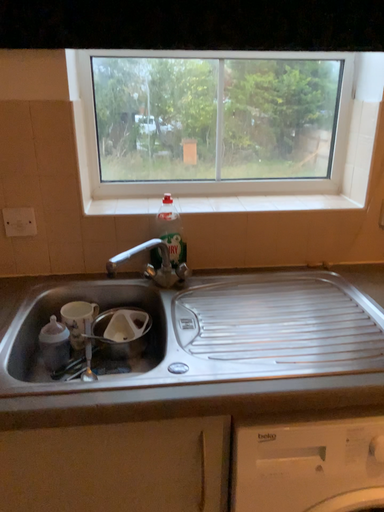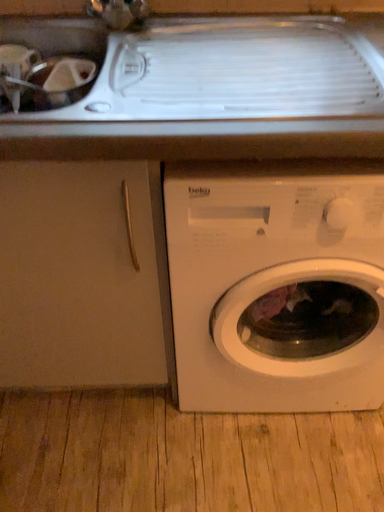
Question: How did the camera likely rotate when shooting the video?

Choices:
 (A) rotated upward
 (B) rotated downward

Answer: (B)